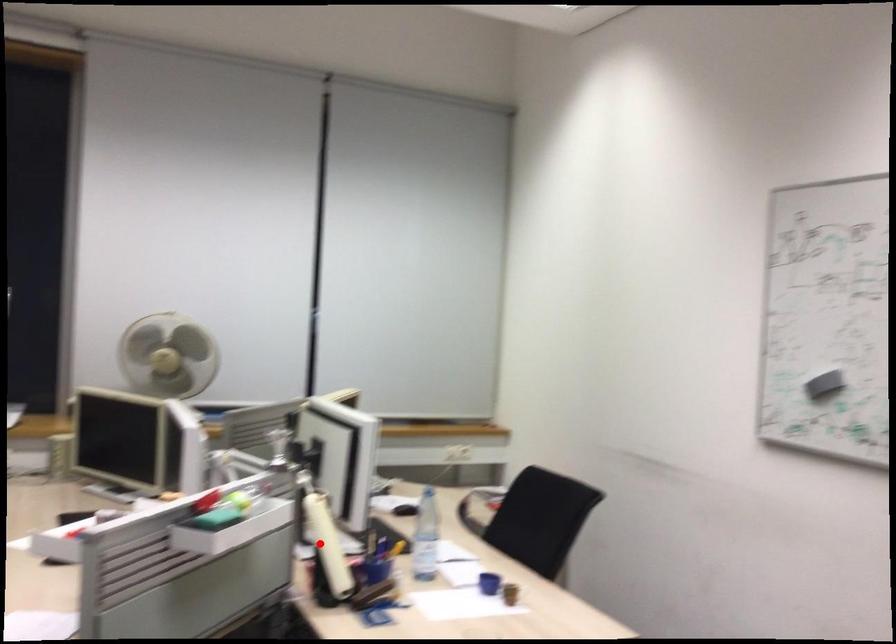
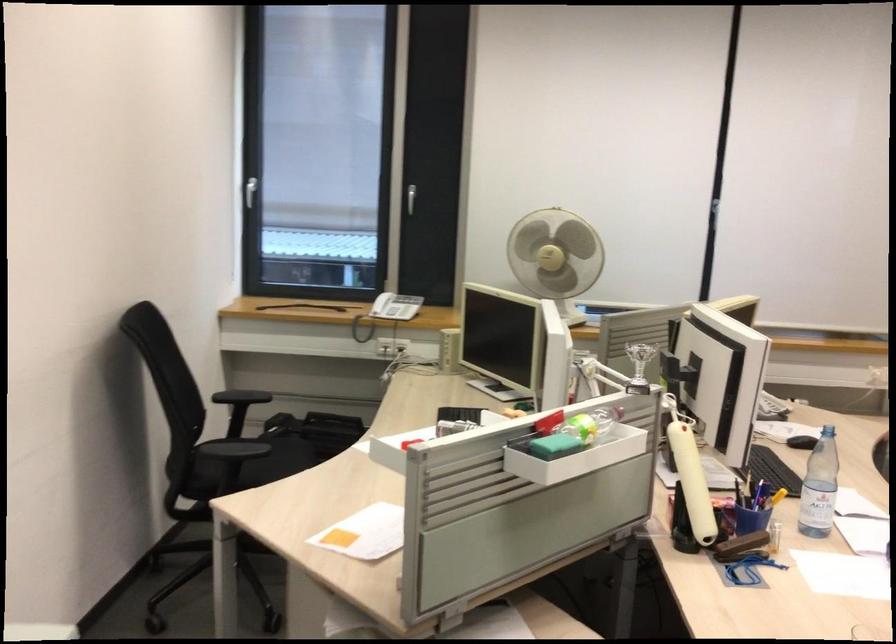
Question: I am providing you with two images of the same scene from different viewpoints. Image1 has a red point marked. In image2, the corresponding 3D location appears at what relative position? Reply with the corresponding letter.

Choices:
 (A) Closer
 (B) Farther

Answer: (A)